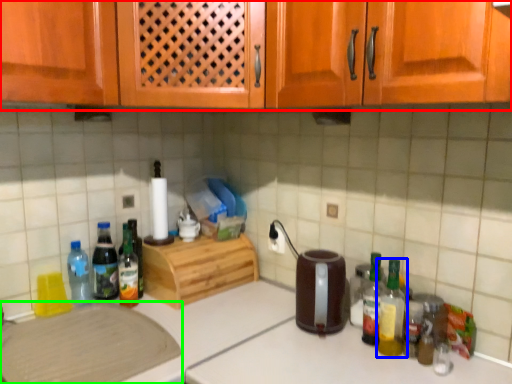
Question: Estimate the real-world distances between objects in this image. Which object is closer to cabinetry (highlighted by a red box), bottle (highlighted by a blue box) or cutting board (highlighted by a green box)?

Choices:
 (A) bottle
 (B) cutting board

Answer: (B)